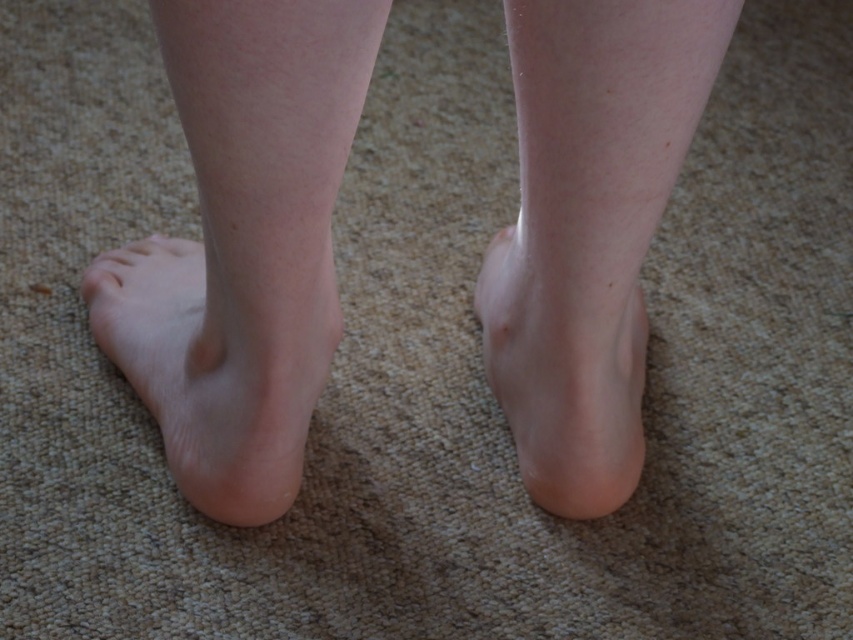
Question: Based on their relative distances, which object is farther from the smooth skin leg at left?

Choices:
 (A) pale skin at center
 (B) smooth skin foot at center
 (C) smooth skin foot at lower left
 (D) skin smooth feet at center

Answer: (B)

Question: Does pale skin at center appear on the right side of smooth skin foot at lower left?

Choices:
 (A) yes
 (B) no

Answer: (A)

Question: Considering the real-world distances, which object is closest to the skin smooth feet at center?

Choices:
 (A) smooth skin foot at center
 (B) smooth skin leg at left

Answer: (B)

Question: Among these points, which one is farthest from the camera?

Choices:
 (A) (604, 45)
 (B) (274, 476)

Answer: (B)

Question: Considering the relative positions of skin smooth feet at center and pale skin at center in the image provided, where is skin smooth feet at center located with respect to pale skin at center?

Choices:
 (A) right
 (B) left

Answer: (B)

Question: Does smooth skin leg at left appear under smooth skin foot at center?

Choices:
 (A) yes
 (B) no

Answer: (B)